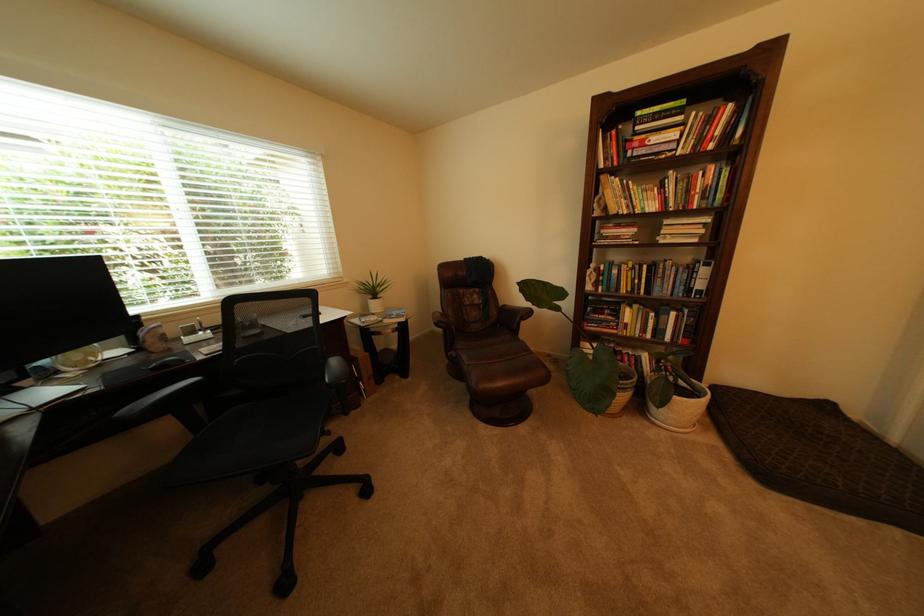
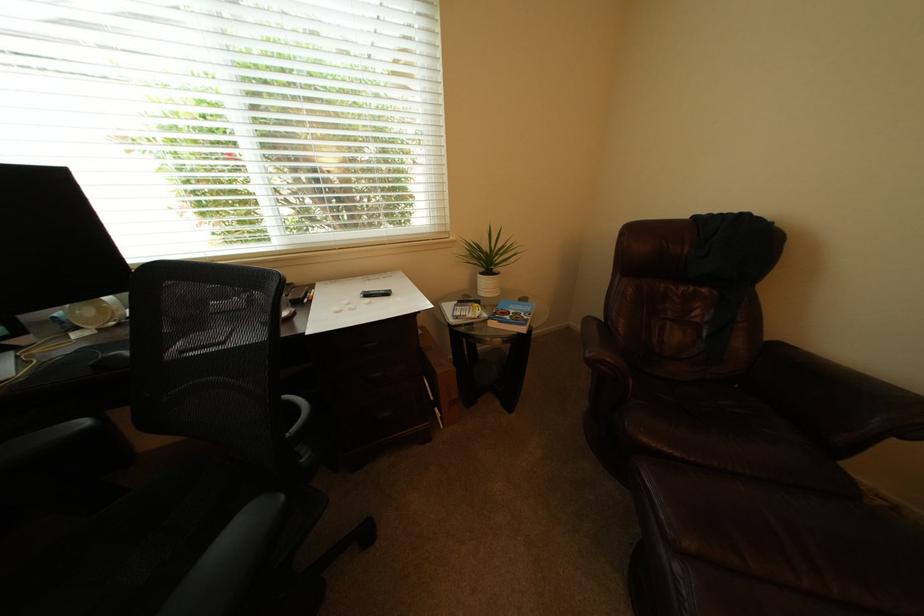
The point at (444, 333) is marked in the first image. Where is the corresponding point in the second image?

(579, 331)